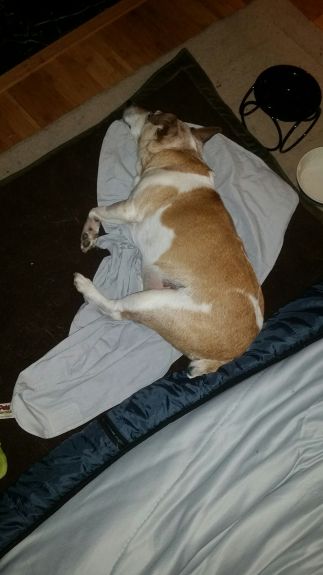
Find the location of a particular element. The width and height of the screenshot is (323, 575). food bowl is located at coordinates (281, 95).